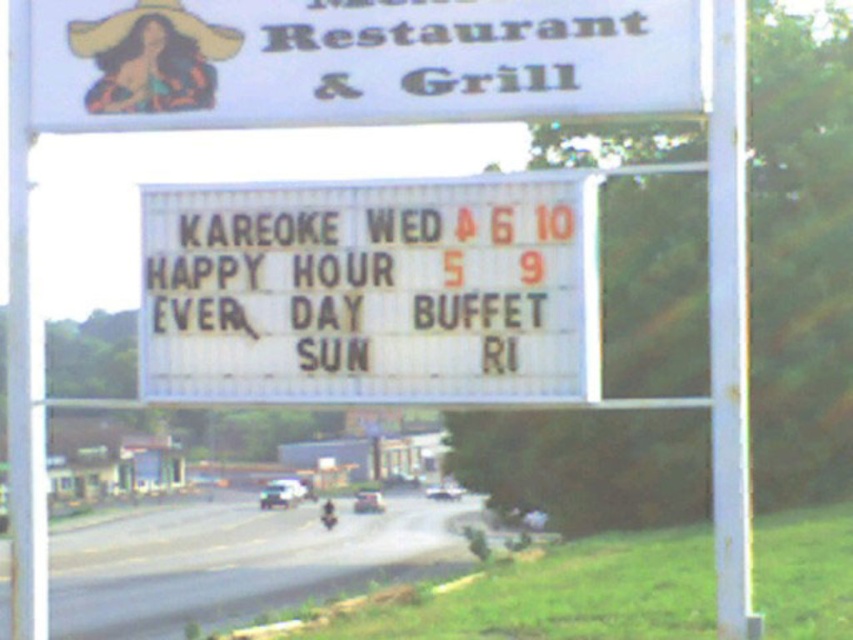
Does yellow fabric cowboy hat at upper left have a lesser width compared to metallic silver motorcycle at center?

No, yellow fabric cowboy hat at upper left is not thinner than metallic silver motorcycle at center.

In the scene shown: Does yellow fabric cowboy hat at upper left come behind metallic silver motorcycle at center?

No.

The height and width of the screenshot is (640, 853). What do you see at coordinates (148, 22) in the screenshot? I see `yellow fabric cowboy hat at upper left` at bounding box center [148, 22].

Find the location of `yellow fabric cowboy hat at upper left`. yellow fabric cowboy hat at upper left is located at coordinates (148, 22).

Is white plastic signboard at center shorter than yellow fabric cowboy hat at upper left?

In fact, white plastic signboard at center may be taller than yellow fabric cowboy hat at upper left.

Between point (329, 381) and point (144, 8), which one is positioned behind?

Positioned behind is point (144, 8).

Measure the distance between white plastic signboard at center and camera.

white plastic signboard at center and camera are 33.38 feet apart from each other.

This screenshot has height=640, width=853. I want to click on white plastic signboard at center, so click(372, 291).

Is point (210, 246) less distant than point (321, 522)?

Yes, it is.

Is white plastic signboard at center above metallic silver motorcycle at center?

Yes, white plastic signboard at center is above metallic silver motorcycle at center.

At what (x,y) coordinates should I click in order to perform the action: click on white plastic signboard at center. Please return your answer as a coordinate pair (x, y). Looking at the image, I should click on (372, 291).